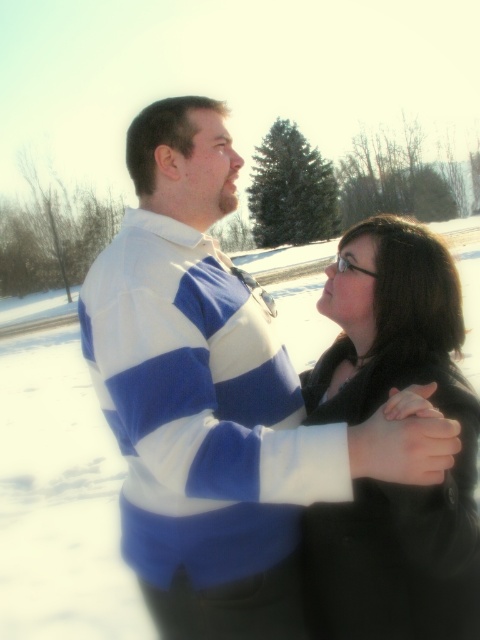
Is blue striped sweater at center positioned in front of black matte coat at center?

That is True.

Who is positioned more to the left, blue striped sweater at center or black matte coat at center?

Positioned to the left is blue striped sweater at center.

Identify the location of blue striped sweater at center. (216, 397).